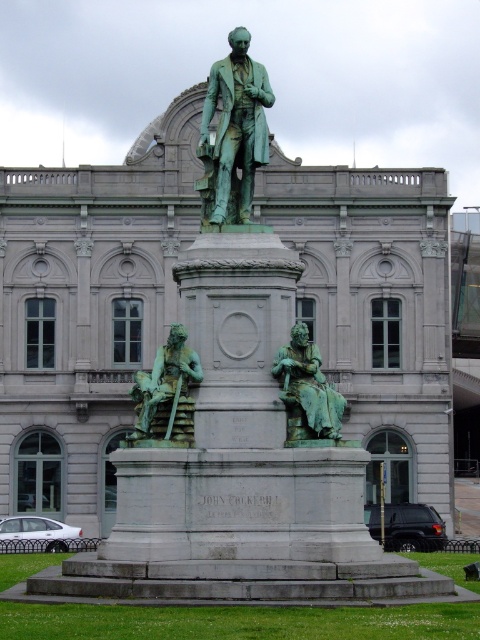
Consider the image. You are an art conservator assessing the statue in front of the classical building. You notice two statues labeled as green patina bronze statue at center and green patina statue at center. Which one is bigger?

The green patina bronze statue at center is larger than the green patina statue at center.

You are standing at the base of the statue and want to walk to the point labeled point (222, 88). Which direction should you walk relative to the point labeled point (159, 371)?

Point (222, 88) is behind point (159, 371), so you should walk away from point (159, 371) to reach point (222, 88).

You are standing in front of the classical building and see the green patinated bronze statue at lower left and the green patina statue at center. Which statue is closer to you?

The green patinated bronze statue at lower left is closer to you because it is positioned over the green patina statue at center, indicating it is in front.